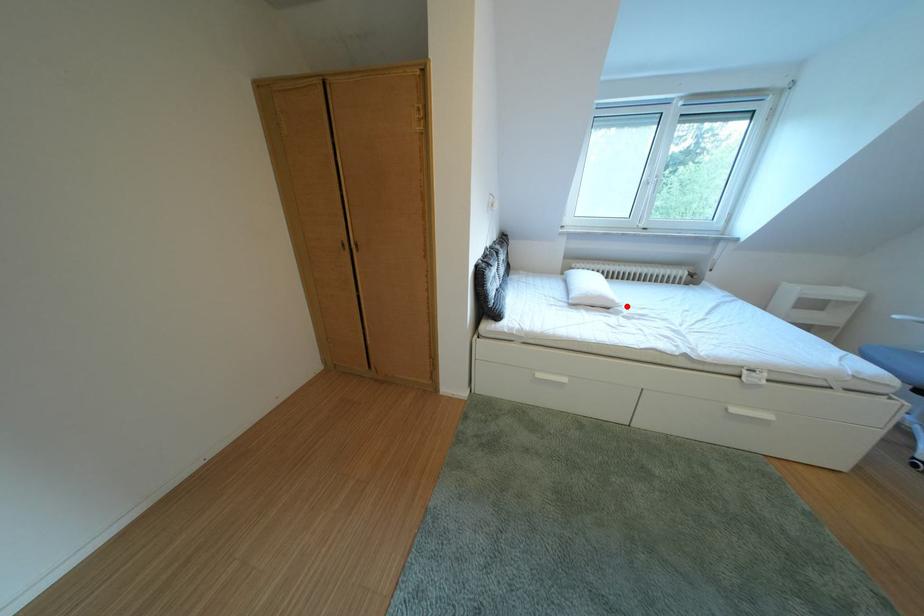
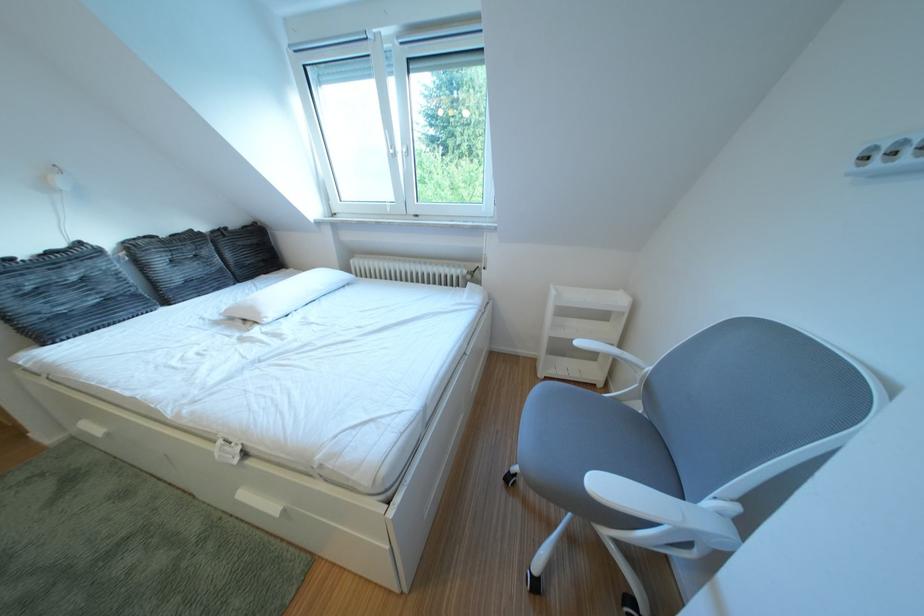
In the second image, find the point that corresponds to the highlighted location in the first image.

(273, 318)